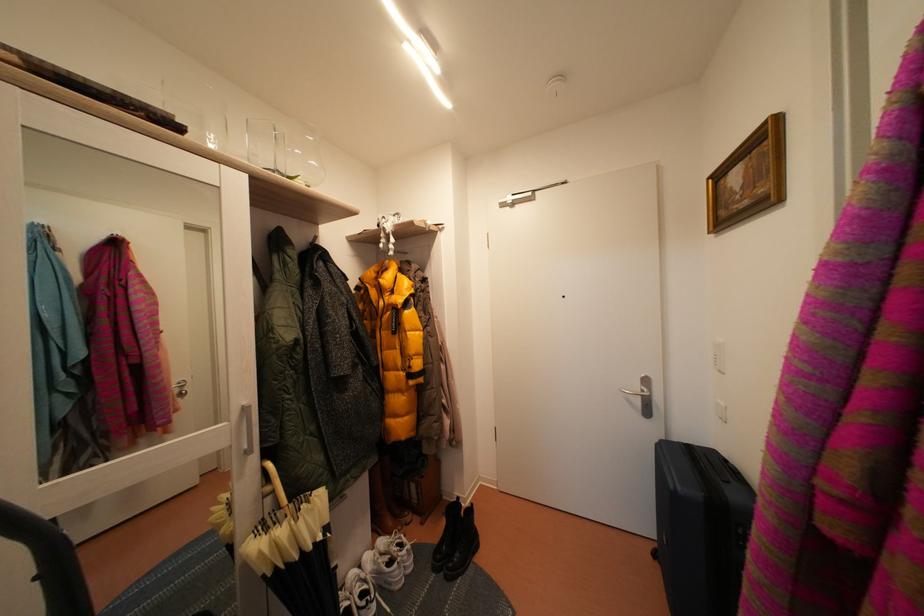
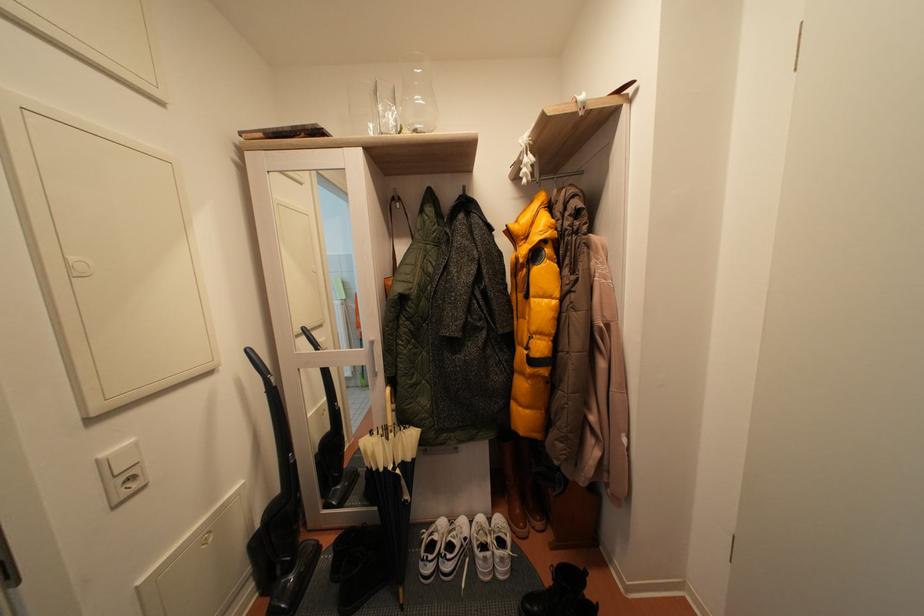
Question: Based on the continuous images, in which direction is the camera rotating? Reply with the corresponding letter.

Choices:
 (A) Left
 (B) Right
 (C) Up
 (D) Down

Answer: (A)